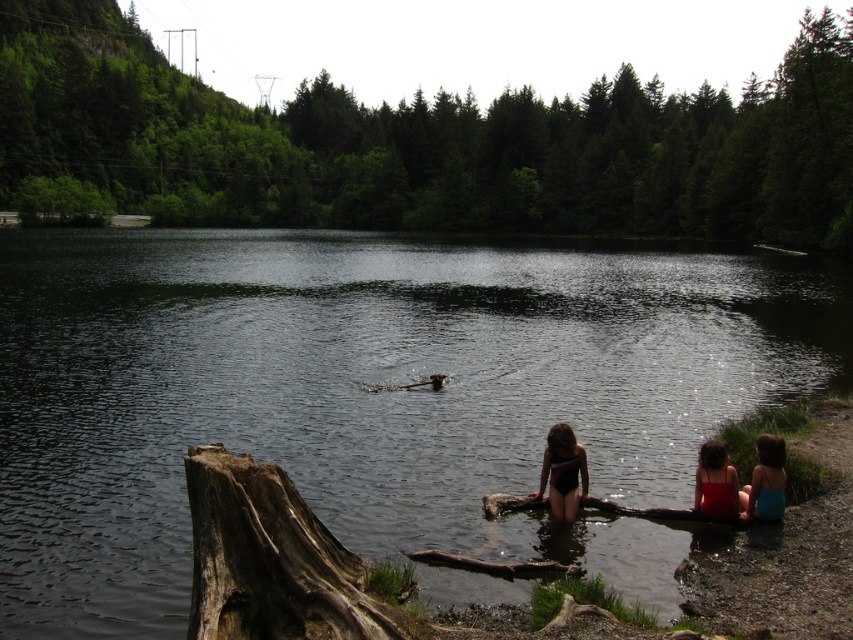
You are standing at the lakeside and want to hand a towel to both the blue fabric swimsuit at lower right and the red fabric swimsuit at lower right. If the towel is 16 inches long, can you reach both of them without moving?

The blue fabric swimsuit at lower right is 17.08 inches away from the red fabric swimsuit at lower right. Since the towel is only 16 inches long, you cannot reach both of them without moving.